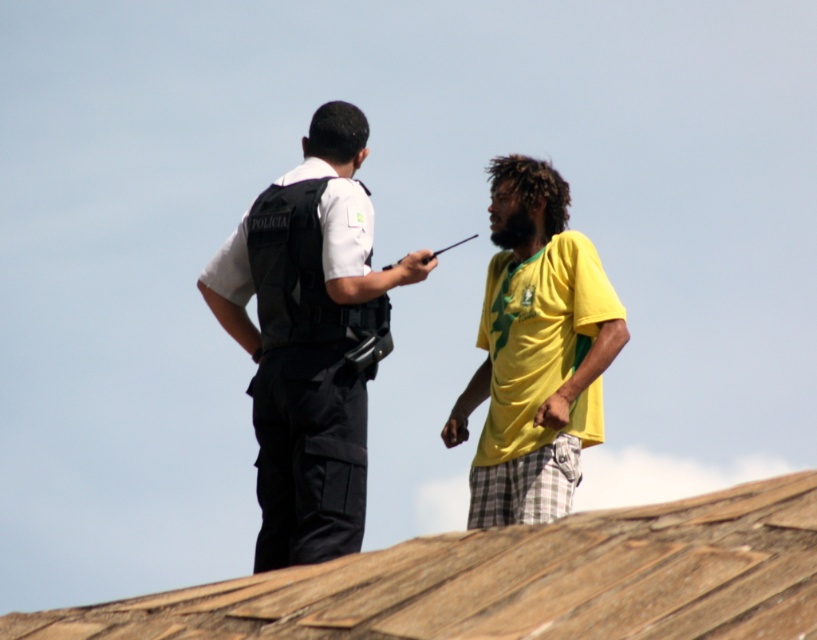
You are a drone operator trying to capture a photo of two people on a rooftop. The first person is at point [182,605] and the second is at point [563,273]. Which point should you focus on to ensure the person closer to the camera is in focus?

Point [182,605] is closer to the camera than point [563,273], so you should focus on point [182,605] to ensure the person closer to the camera is in focus.